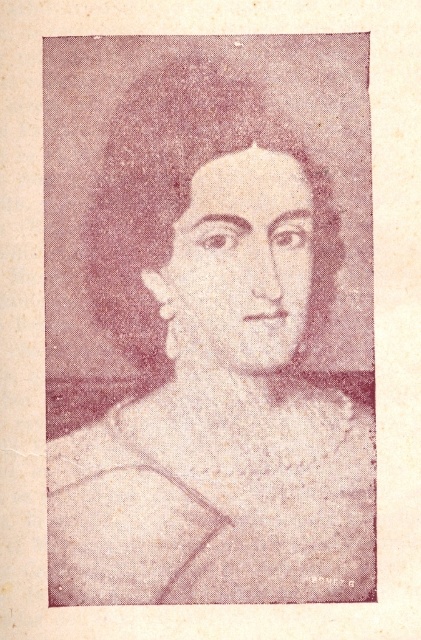
Does gray textured fabric at center have a lesser width compared to textured beige fabric at center?

Yes, gray textured fabric at center is thinner than textured beige fabric at center.

Can you confirm if gray textured fabric at center is smaller than textured beige fabric at center?

Actually, gray textured fabric at center might be larger than textured beige fabric at center.

Who is more forward, (127, 582) or (290, 396)?

Positioned in front is point (127, 582).

What are the coordinates of `gray textured fabric at center` in the screenshot? It's located at (213, 368).